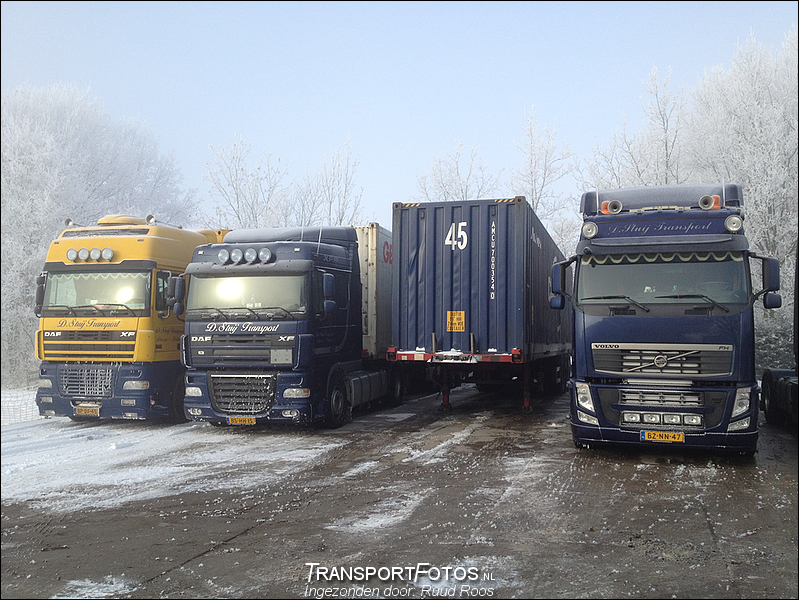
I want to click on mirror, so click(770, 275).